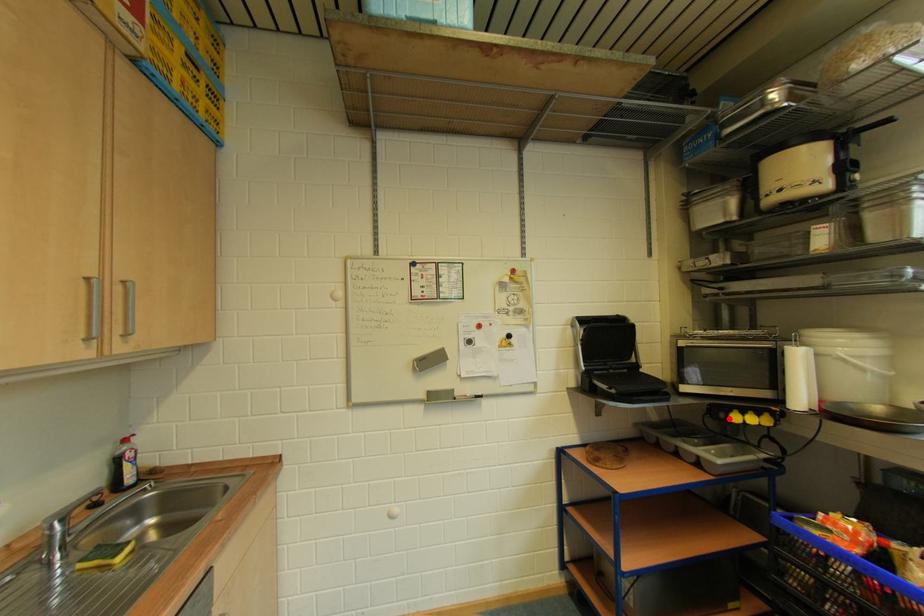
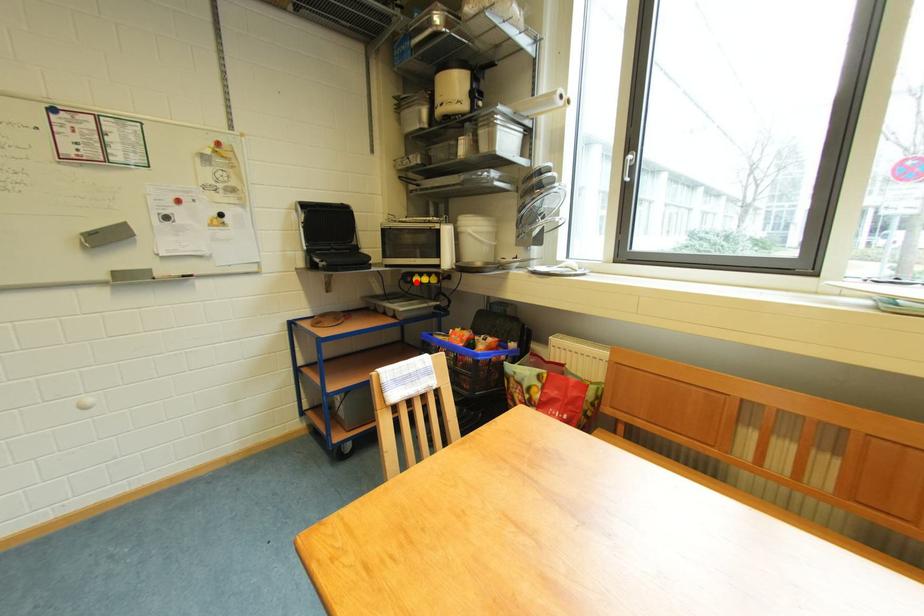
I am providing you with two images of the same scene from different viewpoints. A red point is marked on the first image and another point is marked on the second image. Do the highlighted points in image1 and image2 indicate the same real-world spot?

Yes